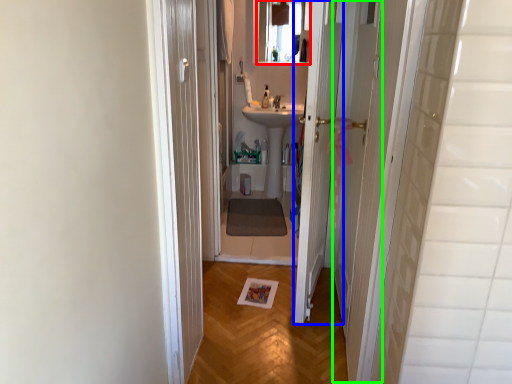
Question: Which object is the farthest from mirror (highlighted by a red box)? Choose among these: door (highlighted by a blue box) or screen door (highlighted by a green box).

Choices:
 (A) door
 (B) screen door

Answer: (A)